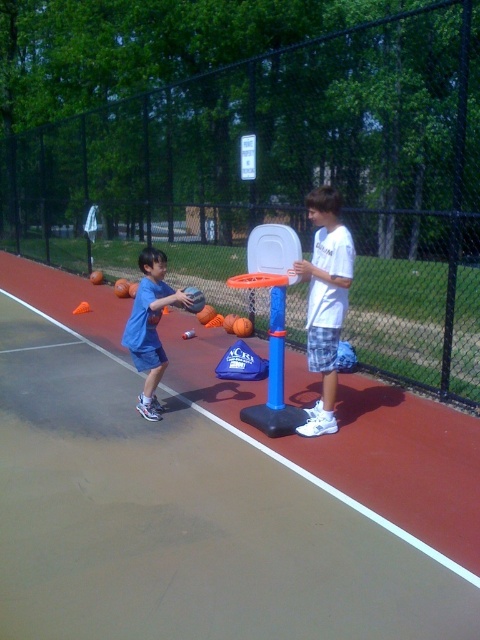
Question: Which object appears closest to the camera in this image?

Choices:
 (A) blue matte shorts at left
 (B) white cotton shirt at center

Answer: (B)

Question: Where is white cotton shirt at center located in relation to blue matte shorts at left in the image?

Choices:
 (A) below
 (B) above

Answer: (B)

Question: Does smooth concrete court at center have a greater width compared to white cotton shirt at center?

Choices:
 (A) no
 (B) yes

Answer: (B)

Question: Is white cotton shirt at center further to the viewer compared to blue matte shorts at left?

Choices:
 (A) no
 (B) yes

Answer: (A)

Question: Which of the following is the farthest from the observer?

Choices:
 (A) (252, 618)
 (B) (312, 253)

Answer: (B)

Question: Estimate the real-world distances between objects in this image. Which object is closer to the blue matte shorts at left?

Choices:
 (A) smooth concrete court at center
 (B) white cotton shirt at center

Answer: (A)